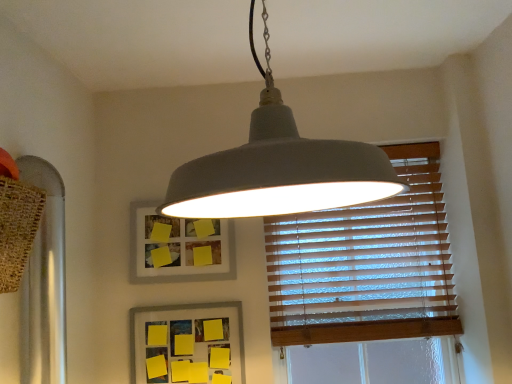
Question: Which direction should I rotate to look at matte gray picture frame at upper center, which is the first picture frame in top-to-bottom order?

Choices:
 (A) right
 (B) left

Answer: (B)

Question: Would you consider matte gray picture frame at upper center, which is the first picture frame in top-to-bottom order, to be distant from matte gray lampshade at center?

Choices:
 (A) no
 (B) yes

Answer: (A)

Question: Is matte gray picture frame at upper center, which is the second picture frame in bottom-to-top order, directly adjacent to matte gray lampshade at center?

Choices:
 (A) no
 (B) yes

Answer: (A)

Question: Does matte gray picture frame at upper center, which is the second picture frame in bottom-to-top order, turn towards matte gray lampshade at center?

Choices:
 (A) yes
 (B) no

Answer: (A)

Question: Is matte gray picture frame at upper center, which is the first picture frame in top-to-bottom order, smaller than matte gray lampshade at center?

Choices:
 (A) yes
 (B) no

Answer: (A)

Question: Is matte gray picture frame at upper center, which is the second picture frame in bottom-to-top order, not inside matte gray lampshade at center?

Choices:
 (A) yes
 (B) no

Answer: (A)

Question: From a real-world perspective, is matte gray picture frame at upper center, which is the first picture frame in top-to-bottom order, physically above matte gray lampshade at center?

Choices:
 (A) no
 (B) yes

Answer: (A)

Question: Considering the relative sizes of wooden blinds at upper right and yellow paper at lower center, the 2th picture frame positioned from the top, in the image provided, is wooden blinds at upper right taller than yellow paper at lower center, the 2th picture frame positioned from the top,?

Choices:
 (A) no
 (B) yes

Answer: (B)

Question: Would you say yellow paper at lower center, the 2th picture frame positioned from the top, is part of wooden blinds at upper right's contents?

Choices:
 (A) no
 (B) yes

Answer: (A)

Question: Does wooden blinds at upper right appear on the left side of yellow paper at lower center, which is the first picture frame from bottom to top?

Choices:
 (A) no
 (B) yes

Answer: (A)

Question: Is wooden blinds at upper right behind yellow paper at lower center, which is the first picture frame from bottom to top?

Choices:
 (A) no
 (B) yes

Answer: (B)

Question: Can we say wooden blinds at upper right lies outside yellow paper at lower center, the 2th picture frame positioned from the top?

Choices:
 (A) no
 (B) yes

Answer: (B)

Question: Is the depth of wooden blinds at upper right less than that of yellow paper at lower center, the 2th picture frame positioned from the top?

Choices:
 (A) no
 (B) yes

Answer: (A)

Question: Is yellow paper at lower center, which is the first picture frame from bottom to top, looking in the opposite direction of matte gray lampshade at center?

Choices:
 (A) yes
 (B) no

Answer: (B)